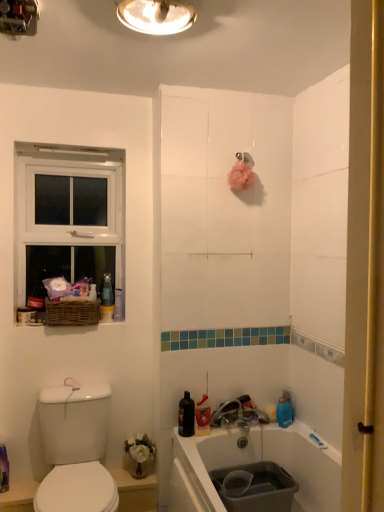
What do you see at coordinates (238, 414) in the screenshot? I see `metallic silver faucet at lower center` at bounding box center [238, 414].

The width and height of the screenshot is (384, 512). What do you see at coordinates (69, 227) in the screenshot?
I see `white plastic window at upper left` at bounding box center [69, 227].

Measure the distance between white plastic window at upper left and camera.

2.20 meters.

The width and height of the screenshot is (384, 512). Describe the element at coordinates (76, 450) in the screenshot. I see `white glossy sink at lower left` at that location.

Find the location of a particular element. This screenshot has height=512, width=384. metallic silver faucet at lower center is located at coordinates (238, 414).

Considering the sizes of white plastic window at upper left and white glossy sink at lower left in the image, is white plastic window at upper left bigger or smaller than white glossy sink at lower left?

Clearly, white plastic window at upper left is smaller in size than white glossy sink at lower left.

From the image's perspective, is white plastic window at upper left positioned above or below white glossy sink at lower left?

From the image's perspective, white plastic window at upper left appears above white glossy sink at lower left.

Is white plastic window at upper left looking in the opposite direction of white glossy sink at lower left?

No, white plastic window at upper left is not facing away from white glossy sink at lower left.

Consider the image. Is white plastic window at upper left far from white glossy sink at lower left?

white plastic window at upper left is near white glossy sink at lower left, not far away.

Considering the positions of objects white glossy sink at lower left and white plastic window at upper left in the image provided, who is more to the right, white glossy sink at lower left or white plastic window at upper left?

Positioned to the right is white glossy sink at lower left.

Is white glossy sink at lower left completely or partially outside of white plastic window at upper left?

Yes.

Is white glossy sink at lower left in contact with white plastic window at upper left?

No.

In the scene shown: Can you confirm if woven brown basket at left is positioned to the right of white plastic window at upper left?

Correct, you'll find woven brown basket at left to the right of white plastic window at upper left.

From the image's perspective, is woven brown basket at left under white plastic window at upper left?

Correct, woven brown basket at left appears lower than white plastic window at upper left in the image.

Does point (49, 310) come farther from viewer compared to point (25, 215)?

No, (49, 310) is closer to viewer.

Does woven brown basket at left have a greater width compared to white plastic window at upper left?

Yes.

Is metallic ceiling light at upper center, which is the 2th light fixture in right-to-left order, looking in the opposite direction of white glossy bidet at lower left?

No, white glossy bidet at lower left is not at the back of metallic ceiling light at upper center, which is the 2th light fixture in right-to-left order.

From a real-world perspective, which is physically below, metallic ceiling light at upper center, the 1th light fixture positioned from the left, or white glossy bidet at lower left?

white glossy bidet at lower left.

Considering the positions of objects metallic ceiling light at upper center, the 1th light fixture positioned from the left, and white glossy bidet at lower left in the image provided, who is more to the right, metallic ceiling light at upper center, the 1th light fixture positioned from the left, or white glossy bidet at lower left?

metallic ceiling light at upper center, the 1th light fixture positioned from the left.

Can you confirm if white glossy sink at lower left is thinner than metallic ceiling light at upper center, which is the 2th light fixture in right-to-left order?

In fact, white glossy sink at lower left might be wider than metallic ceiling light at upper center, which is the 2th light fixture in right-to-left order.

Is white glossy sink at lower left far away from metallic ceiling light at upper center, which is the 2th light fixture in right-to-left order?

white glossy sink at lower left is far away from metallic ceiling light at upper center, which is the 2th light fixture in right-to-left order.

Between white glossy sink at lower left and metallic ceiling light at upper center, which is the 2th light fixture in right-to-left order, which one appears on the right side from the viewer's perspective?

Positioned to the right is white glossy sink at lower left.

Is white glossy sink at lower left behind metallic ceiling light at upper center, which is the 2th light fixture in right-to-left order?

Yes, it is behind metallic ceiling light at upper center, which is the 2th light fixture in right-to-left order.

Considering the relative sizes of woven brown basket at left and metallic silver faucet at lower center in the image provided, is woven brown basket at left wider than metallic silver faucet at lower center?

Yes, woven brown basket at left is wider than metallic silver faucet at lower center.

Considering the points (85, 318) and (217, 409), which point is behind, point (85, 318) or point (217, 409)?

The point (217, 409) is more distant.

Between woven brown basket at left and metallic silver faucet at lower center, which one appears on the left side from the viewer's perspective?

woven brown basket at left is more to the left.

Between woven brown basket at left and metallic silver faucet at lower center, which one has smaller size?

metallic silver faucet at lower center is smaller.

From a real-world perspective, is metallic dome at upper center, which ranks as the first light fixture in right-to-left order, on top of white glossy sink at lower left?

Yes, from a real-world perspective, metallic dome at upper center, which ranks as the first light fixture in right-to-left order, is on top of white glossy sink at lower left.

Locate an element on the screen. the 2nd light fixture positioned above the white glossy sink at lower left (from the image's perspective) is located at coordinates (156, 16).

Does metallic dome at upper center, which appears as the 2th light fixture when viewed from the left, turn towards white glossy sink at lower left?

No, metallic dome at upper center, which appears as the 2th light fixture when viewed from the left, is not facing towards white glossy sink at lower left.

At what (x,y) coordinates should I click in order to perform the action: click on sink located below the white plastic window at upper left (from the image's perspective). Please return your answer as a coordinate pair (x, y). This screenshot has height=512, width=384. Looking at the image, I should click on (76, 450).

I want to click on window above the white glossy sink at lower left (from a real-world perspective), so click(69, 227).

Looking at the image, which one is located further to white glossy sink at lower left, metallic silver faucet at lower center or woven brown basket at left?

metallic silver faucet at lower center.

Consider the image. Estimate the real-world distances between objects in this image. Which object is further from metallic silver faucet at lower center, metallic ceiling light at upper center, the 1th light fixture positioned from the left, or white plastic window at upper left?

The object further to metallic silver faucet at lower center is metallic ceiling light at upper center, the 1th light fixture positioned from the left.

Considering their positions, is metallic dome at upper center, which appears as the 2th light fixture when viewed from the left, positioned closer to woven brown basket at left than metallic silver faucet at lower center?

Based on the image, metallic silver faucet at lower center appears to be nearer to woven brown basket at left.

When comparing their distances from woven brown basket at left, does metallic silver faucet at lower center or white glossy bidet at lower left seem further?

Among the two, metallic silver faucet at lower center is located further to woven brown basket at left.

Considering their positions, is woven brown basket at left positioned closer to metallic dome at upper center, which ranks as the first light fixture in right-to-left order, than white glossy sink at lower left?

Among the two, woven brown basket at left is located nearer to metallic dome at upper center, which ranks as the first light fixture in right-to-left order.

Estimate the real-world distances between objects in this image. Which object is further from white glossy sink at lower left, white glossy bidet at lower left or metallic ceiling light at upper center, which is the 2th light fixture in right-to-left order?

Based on the image, metallic ceiling light at upper center, which is the 2th light fixture in right-to-left order, appears to be further to white glossy sink at lower left.

Based on their spatial positions, is metallic dome at upper center, which appears as the 2th light fixture when viewed from the left, or white glossy sink at lower left closer to white plastic window at upper left?

Based on the image, white glossy sink at lower left appears to be nearer to white plastic window at upper left.

When comparing their distances from metallic ceiling light at upper center, the 1th light fixture positioned from the left, does woven brown basket at left or white glossy sink at lower left seem closer?

The object closer to metallic ceiling light at upper center, the 1th light fixture positioned from the left, is woven brown basket at left.

This screenshot has width=384, height=512. In order to click on sink between metallic dome at upper center, which ranks as the first light fixture in right-to-left order, and white glossy bidet at lower left from top to bottom in this screenshot , I will do `click(76, 450)`.

Locate an element on the screen. The image size is (384, 512). basket between white plastic window at upper left and white glossy sink at lower left from top to bottom is located at coordinates (72, 313).

Where is `tap that lies between metallic dome at upper center, which ranks as the first light fixture in right-to-left order, and white glossy sink at lower left from top to bottom`? tap that lies between metallic dome at upper center, which ranks as the first light fixture in right-to-left order, and white glossy sink at lower left from top to bottom is located at coordinates (238, 414).

You are a GUI agent. You are given a task and a screenshot of the screen. Output one action in this format:
    pyautogui.click(x=<x>, y=<y>)
    Task: Click on the tap that lies between metallic ceiling light at upper center, the 1th light fixture positioned from the left, and white glossy sink at lower left from top to bottom
    This screenshot has height=512, width=384.
    Given the screenshot: What is the action you would take?
    pyautogui.click(x=238, y=414)